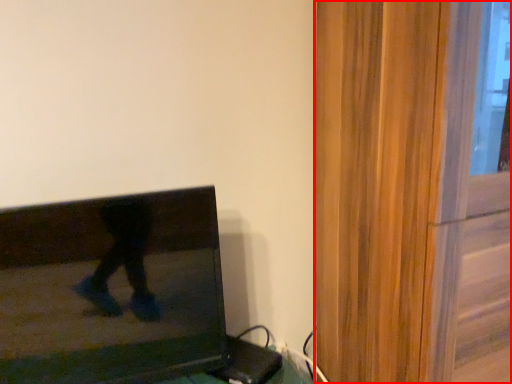
Question: Considering the relative positions of screen door (annotated by the red box) and television in the image provided, where is screen door (annotated by the red box) located with respect to the staircase?

Choices:
 (A) left
 (B) right

Answer: (B)